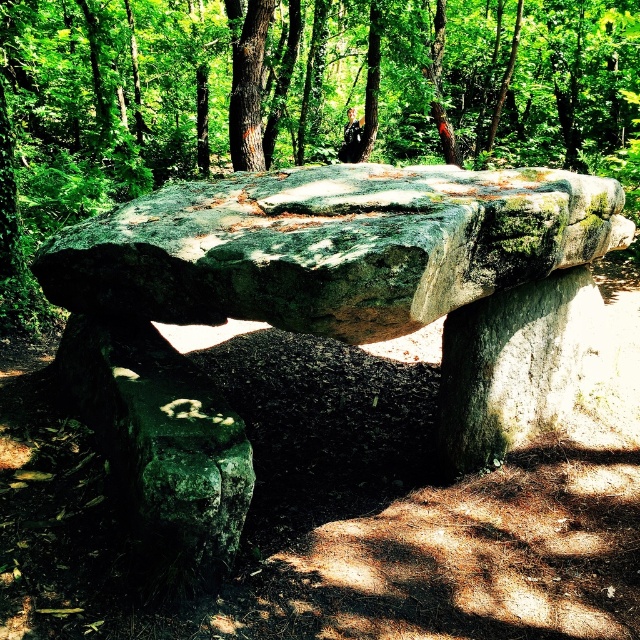
Question: Which of the following is the farthest from the observer?

Choices:
 (A) (218, 282)
 (B) (502, 22)

Answer: (B)

Question: Is green mossy stone bench at center positioned before green mossy rock at center?

Choices:
 (A) no
 (B) yes

Answer: (B)

Question: Which object appears farthest from the camera in this image?

Choices:
 (A) green mossy stone bench at center
 (B) green mossy rock at center

Answer: (B)

Question: Can you confirm if green mossy stone bench at center is smaller than green mossy rock at center?

Choices:
 (A) no
 (B) yes

Answer: (B)

Question: Can you confirm if green mossy stone bench at center is thinner than green mossy rock at center?

Choices:
 (A) yes
 (B) no

Answer: (A)

Question: Among these points, which one is farthest from the camera?

Choices:
 (A) [298, 212]
 (B) [611, 20]

Answer: (B)